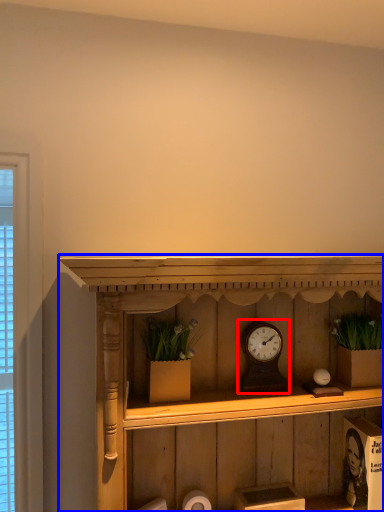
Question: Which of the following is the farthest to the observer, alarm clock (highlighted by a red box) or shelf (highlighted by a blue box)?

Choices:
 (A) alarm clock
 (B) shelf

Answer: (A)